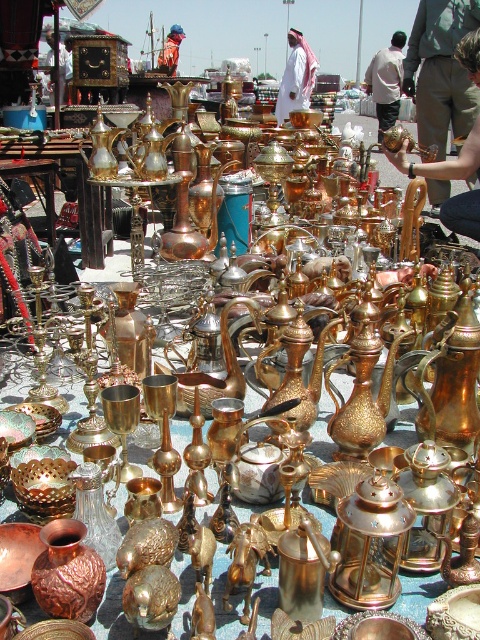
Question: Can you confirm if white fabric shirt at upper center is wider than brushed metal teapot at upper left?

Choices:
 (A) no
 (B) yes

Answer: (B)

Question: Is brushed metal teapot at upper left wider than brushed metal helmet at upper center?

Choices:
 (A) no
 (B) yes

Answer: (A)

Question: Which is farther from the brushed metal helmet at upper center?

Choices:
 (A) brushed metal teapot at upper left
 (B) white fabric shirt at upper center

Answer: (A)

Question: Among these points, which one is farthest from the camera?

Choices:
 (A) (477, 38)
 (B) (51, 48)
 (C) (279, 113)
 (D) (391, 65)

Answer: (D)

Question: Among these points, which one is farthest from the camera?

Choices:
 (A) (389, 52)
 (B) (468, 218)
 (C) (50, 88)

Answer: (A)

Question: Does white fabric shirt at upper center lie in front of brushed metal helmet at upper center?

Choices:
 (A) yes
 (B) no

Answer: (A)